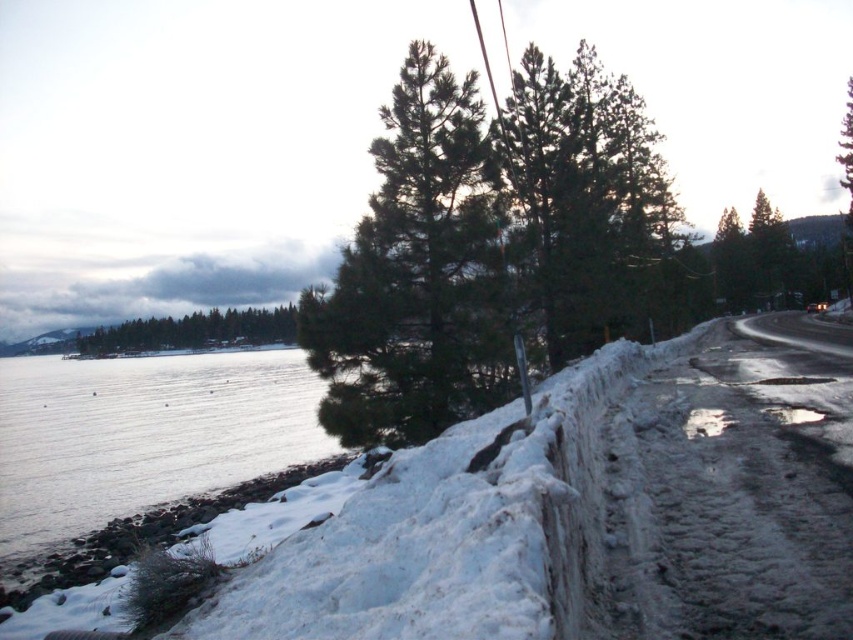
Which of these two, green needle-like tree at center or green matte trees at left, stands taller?

Standing taller between the two is green needle-like tree at center.

Is green needle-like tree at center to the left of green matte trees at left from the viewer's perspective?

Incorrect, green needle-like tree at center is not on the left side of green matte trees at left.

Who is more forward, (416,61) or (140,330)?

Point (416,61) is in front.

Find the location of a particular element. This screenshot has width=853, height=640. green needle-like tree at center is located at coordinates (418, 273).

Image resolution: width=853 pixels, height=640 pixels. What do you see at coordinates (142, 435) in the screenshot?
I see `clear water at lower left` at bounding box center [142, 435].

This screenshot has height=640, width=853. What are the coordinates of `clear water at lower left` in the screenshot? It's located at (142, 435).

Locate an element on the screen. Image resolution: width=853 pixels, height=640 pixels. clear water at lower left is located at coordinates (142, 435).

Is green needle-like tree at center positioned in front of clear water at lower left?

That is True.

Is green needle-like tree at center wider than clear water at lower left?

No, green needle-like tree at center is not wider than clear water at lower left.

Is point (366, 282) positioned before point (138, 470)?

That is True.

Where is `green needle-like tree at center`? Image resolution: width=853 pixels, height=640 pixels. green needle-like tree at center is located at coordinates (418, 273).